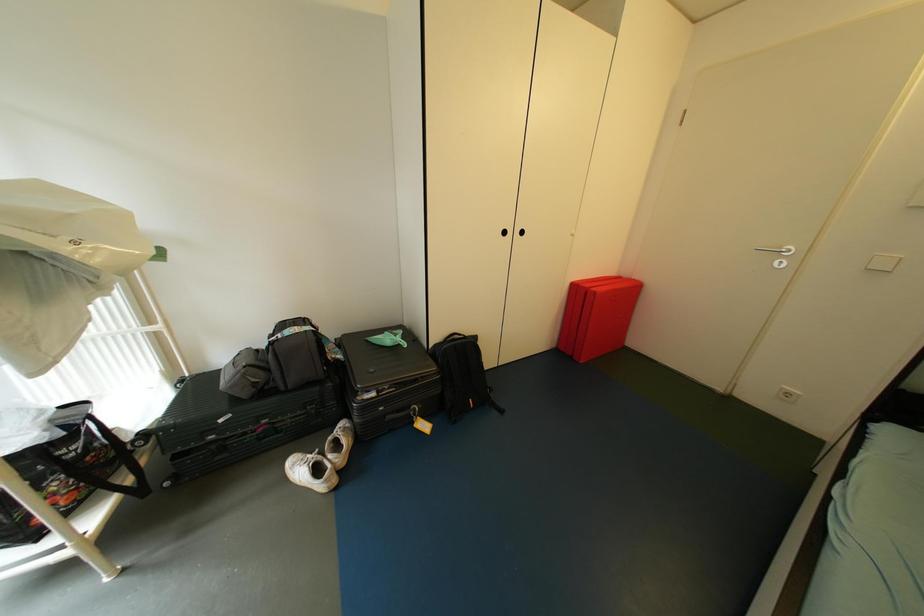
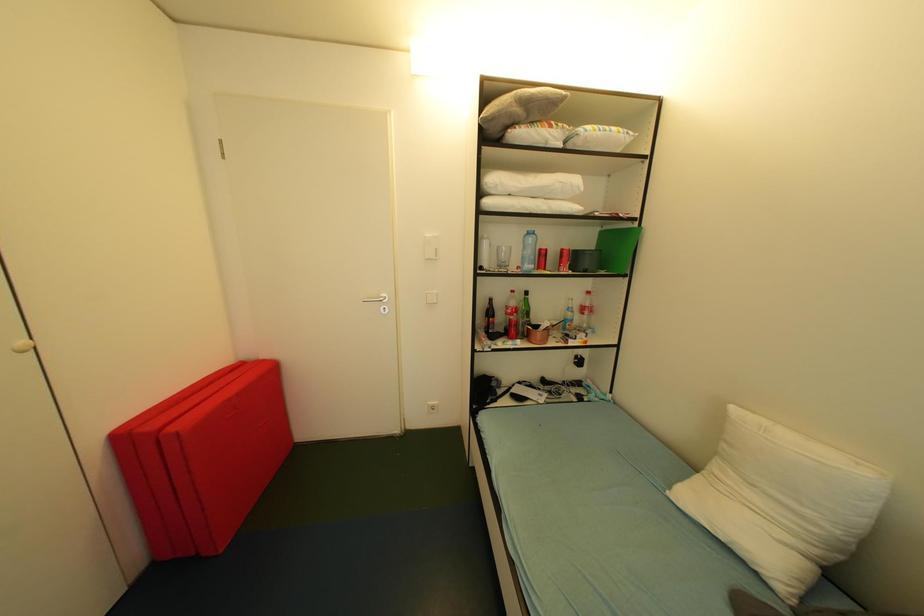
Question: The first image is from the beginning of the video and the second image is from the end. How did the camera likely rotate when shooting the video?

Choices:
 (A) Left
 (B) Right
 (C) Up
 (D) Down

Answer: (B)